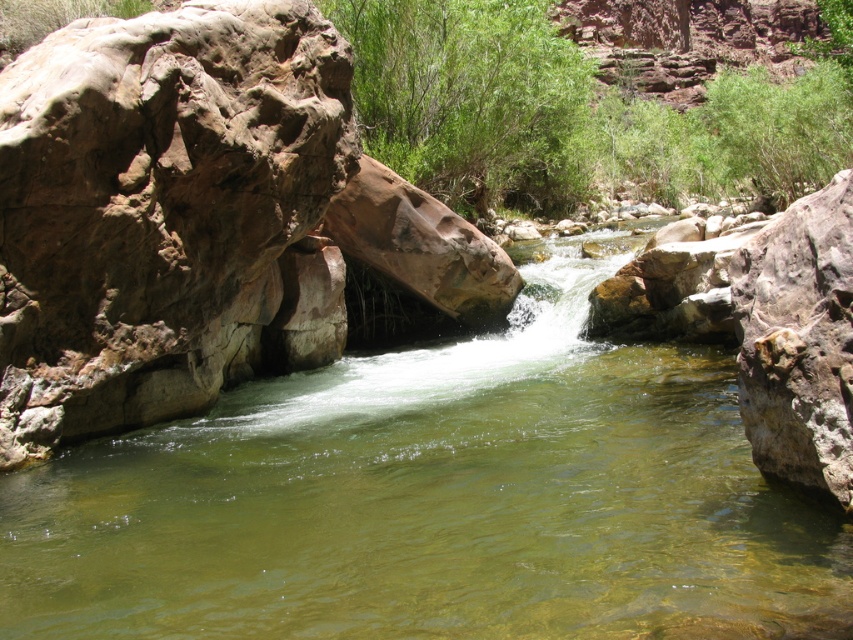
From the picture: Can you confirm if clear water stream at center is thinner than brown rough rock at left?

No.

Does clear water stream at center have a greater height compared to brown rough rock at left?

No.

The image size is (853, 640). What are the coordinates of `clear water stream at center` in the screenshot? It's located at (436, 500).

Is brown rough rock at left to the left of green leafy shrubs at center from the viewer's perspective?

Yes, brown rough rock at left is to the left of green leafy shrubs at center.

Between brown rough rock at left and green leafy shrubs at center, which one appears on the right side from the viewer's perspective?

green leafy shrubs at center is more to the right.

Identify the location of brown rough rock at left. (189, 216).

Is point (639, 582) positioned in front of point (837, 81)?

Yes, it is.

Image resolution: width=853 pixels, height=640 pixels. Identify the location of clear water stream at center. (436, 500).

Does point (186, 502) come behind point (556, 160)?

No.

You are a GUI agent. You are given a task and a screenshot of the screen. Output one action in this format:
    pyautogui.click(x=<x>, y=<y>)
    Task: Click on the clear water stream at center
    
    Given the screenshot: What is the action you would take?
    pyautogui.click(x=436, y=500)